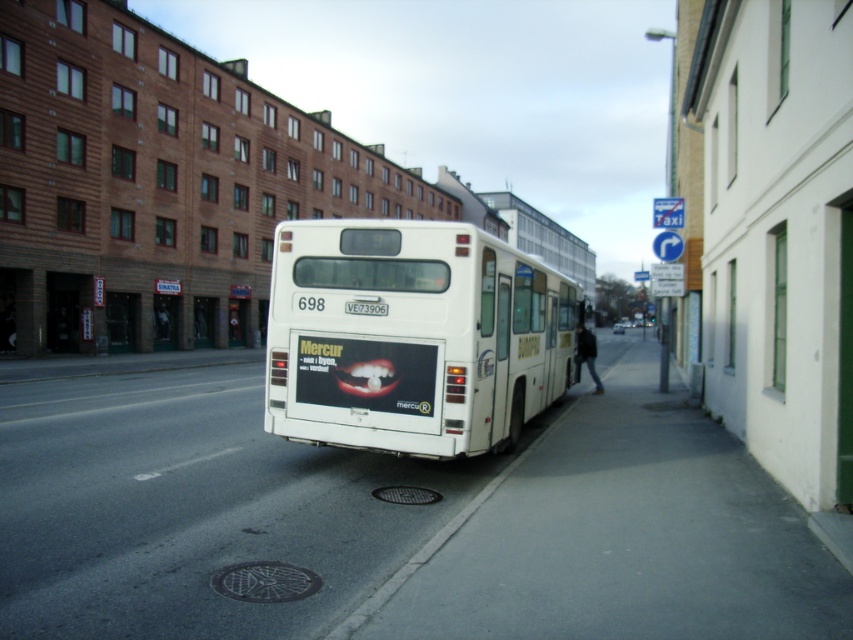
Question: Does white matte bus at center appear on the left side of white plastic license plate at rear?

Choices:
 (A) no
 (B) yes

Answer: (A)

Question: Which point appears closest to the camera in this image?

Choices:
 (A) (376, 301)
 (B) (402, 221)

Answer: (B)

Question: Does white matte bus at center appear on the left side of white plastic license plate at rear?

Choices:
 (A) yes
 (B) no

Answer: (B)

Question: Is white matte bus at center smaller than white plastic license plate at rear?

Choices:
 (A) yes
 (B) no

Answer: (B)

Question: Which point is closer to the camera?

Choices:
 (A) white matte bus at center
 (B) white plastic license plate at rear

Answer: (A)